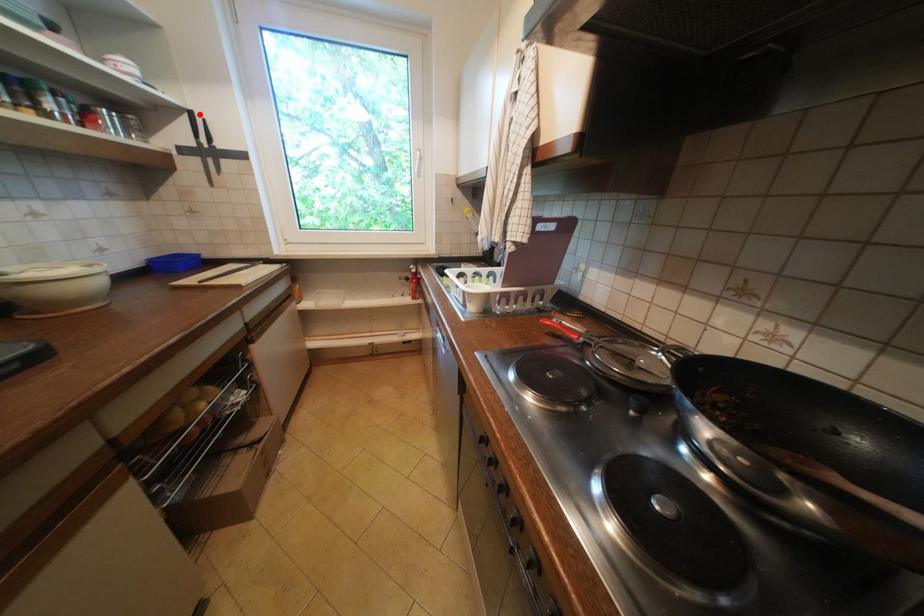
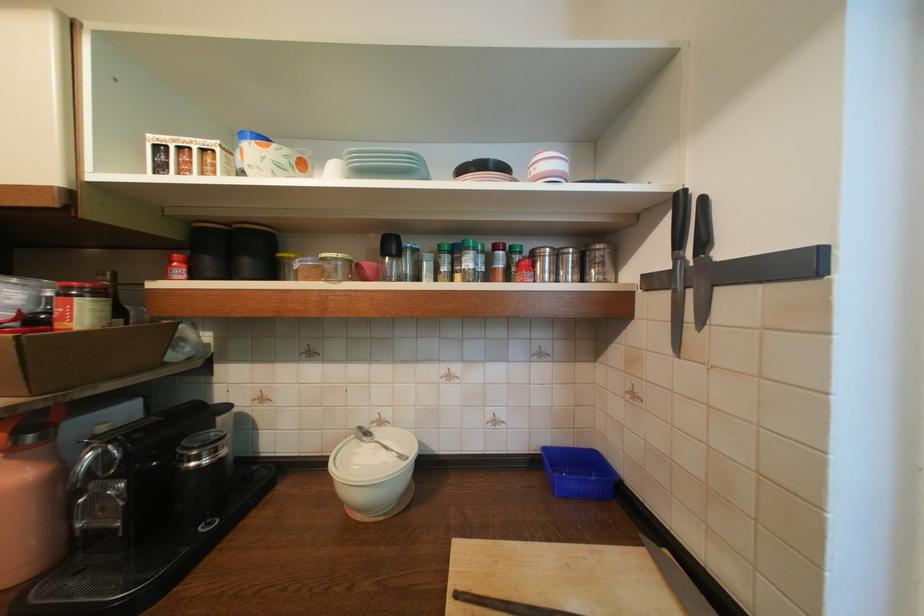
In the second image, find the point that corresponds to the highlighted location in the first image.

(687, 199)